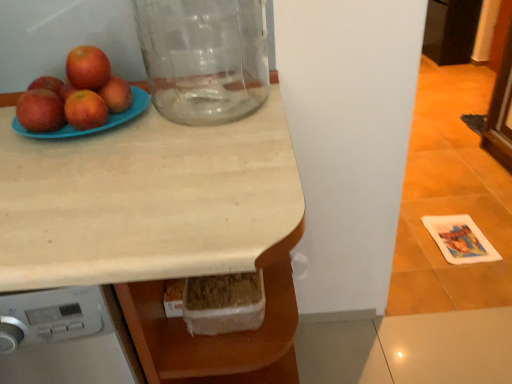
Question: From a real-world perspective, is shiny red apple at upper left, placed as the third apple when sorted from right to left, on top of matte red apple at upper left, which is the fourth apple from left to right?

Choices:
 (A) no
 (B) yes

Answer: (B)

Question: Does shiny red apple at upper left, the second apple viewed from the left, appear on the left side of matte red apple at upper left, which is the fourth apple from left to right?

Choices:
 (A) yes
 (B) no

Answer: (A)

Question: Does shiny red apple at upper left, placed as the third apple when sorted from right to left, have a lesser height compared to matte red apple at upper left, placed as the first apple when sorted from right to left?

Choices:
 (A) no
 (B) yes

Answer: (A)

Question: Is the surface of shiny red apple at upper left, placed as the third apple when sorted from right to left, in direct contact with matte red apple at upper left, placed as the first apple when sorted from right to left?

Choices:
 (A) yes
 (B) no

Answer: (A)

Question: Is shiny red apple at upper left, the second apple viewed from the left, positioned before matte red apple at upper left, which is the fourth apple from left to right?

Choices:
 (A) yes
 (B) no

Answer: (A)

Question: Is transparent glass jar at upper left shorter than matte blue plate at upper left?

Choices:
 (A) yes
 (B) no

Answer: (B)

Question: Considering the relative sizes of transparent glass jar at upper left and matte blue plate at upper left in the image provided, is transparent glass jar at upper left smaller than matte blue plate at upper left?

Choices:
 (A) yes
 (B) no

Answer: (B)

Question: Considering the relative sizes of transparent glass jar at upper left and matte blue plate at upper left in the image provided, is transparent glass jar at upper left thinner than matte blue plate at upper left?

Choices:
 (A) yes
 (B) no

Answer: (A)

Question: From a real-world perspective, is transparent glass jar at upper left below matte blue plate at upper left?

Choices:
 (A) no
 (B) yes

Answer: (A)

Question: Is transparent glass jar at upper left closer to camera compared to matte blue plate at upper left?

Choices:
 (A) yes
 (B) no

Answer: (A)

Question: Is transparent glass jar at upper left touching matte blue plate at upper left?

Choices:
 (A) no
 (B) yes

Answer: (A)

Question: Is glossy red apple at left, which is the first apple from left to right, positioned far away from transparent glass jar at upper left?

Choices:
 (A) yes
 (B) no

Answer: (B)